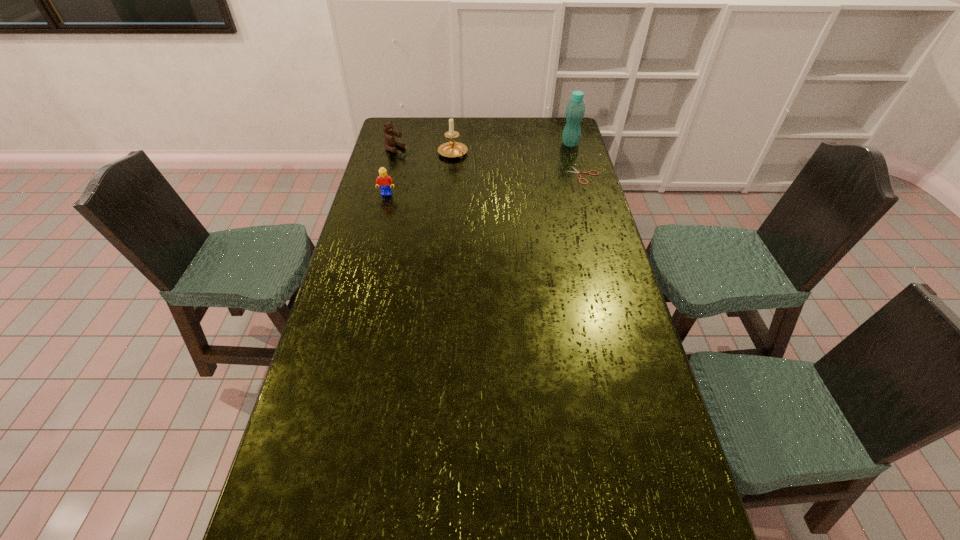
This screenshot has width=960, height=540. Identify the location of free space on the desktop that is between the nearest object and the shears and is positioned at the front cap of the water bottle. (509, 183).

Locate an element on the screen. vacant space on the desktop that is between the Lego and the shortest object and is positioned with a handle on the side of the third object from left to right is located at coordinates coord(493,184).

This screenshot has width=960, height=540. Find the location of `vacant spot on the desktop that is between the nearest object and the second nearest object and is positioned on the face of the teddy bear`. vacant spot on the desktop that is between the nearest object and the second nearest object and is positioned on the face of the teddy bear is located at coordinates (473, 186).